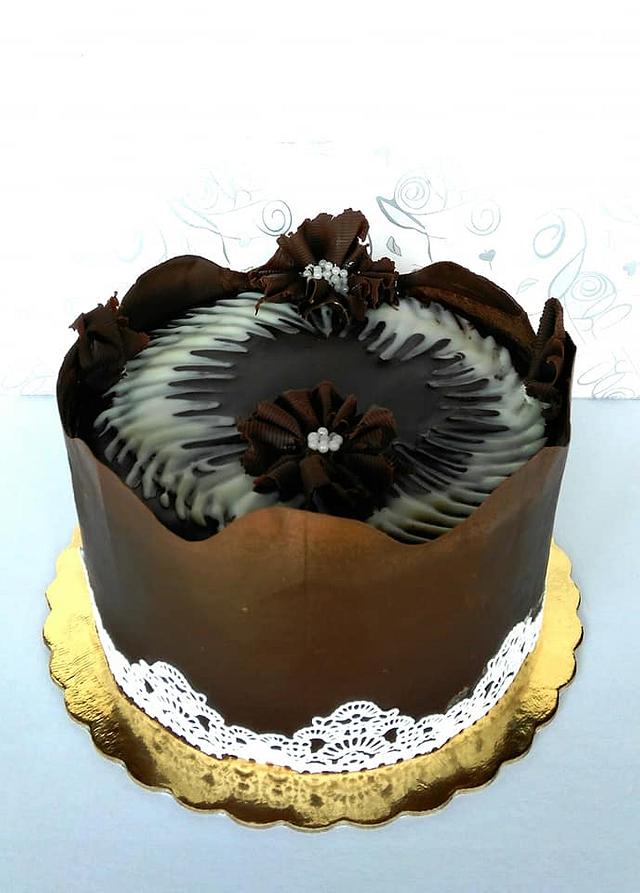
Find the location of a particular element. platter is located at coordinates (228, 793).